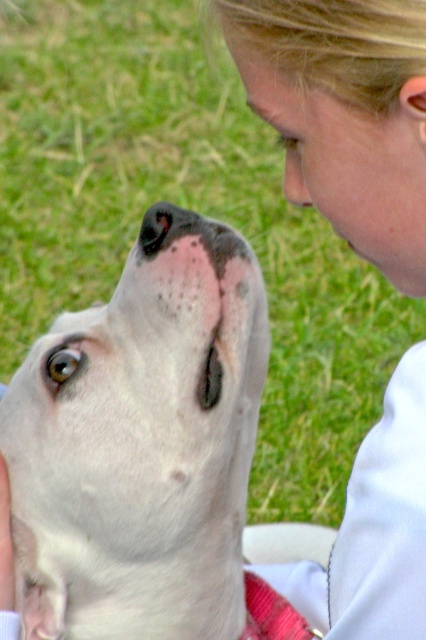
Question: Which object appears farthest from the camera in this image?

Choices:
 (A) blonde hair at upper center
 (B) white smooth dog at center

Answer: (B)

Question: Is white smooth dog at center behind pink soft tissue at upper center?

Choices:
 (A) yes
 (B) no

Answer: (A)

Question: Does blonde hair at upper center have a smaller size compared to pink soft tissue at upper center?

Choices:
 (A) yes
 (B) no

Answer: (B)

Question: Which of the following is the closest to the observer?

Choices:
 (A) pink soft tissue at upper center
 (B) blonde hair at upper center

Answer: (B)

Question: Which of these objects is positioned closest to the pink soft tissue at upper center?

Choices:
 (A) white smooth dog at center
 (B) blonde hair at upper center

Answer: (B)

Question: Does white smooth dog at center appear over pink soft tissue at upper center?

Choices:
 (A) no
 (B) yes

Answer: (A)